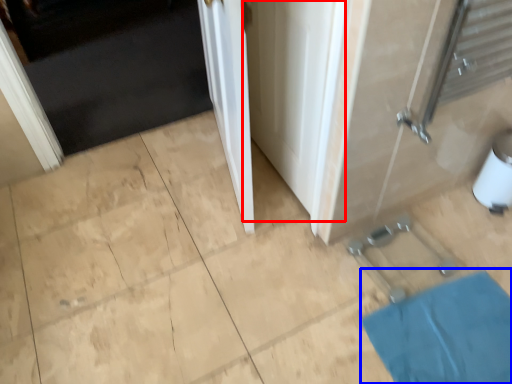
Question: Among these objects, which one is farthest to the camera, screen door (highlighted by a red box) or bath mat (highlighted by a blue box)?

Choices:
 (A) screen door
 (B) bath mat

Answer: (B)